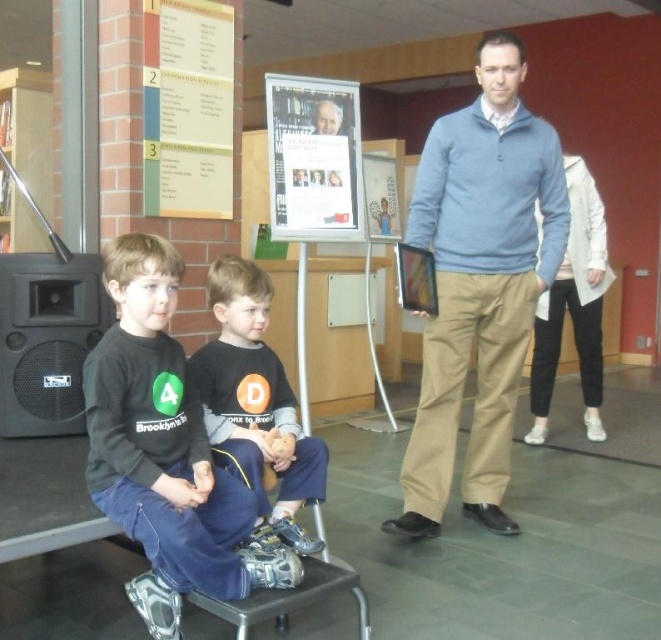
Question: Among these objects, which one is nearest to the camera?

Choices:
 (A) black cotton shirt at lower left
 (B) black matte speaker at left
 (C) smooth skin face at upper center
 (D) black cotton shirt at center

Answer: (A)

Question: Which point is farther to the camera?

Choices:
 (A) black cotton shirt at lower left
 (B) black matte speaker at left

Answer: (B)

Question: From the image, what is the correct spatial relationship of blue sweater at center in relation to black matte speaker at left?

Choices:
 (A) above
 (B) below

Answer: (A)

Question: Which point is closer to the camera?

Choices:
 (A) (81, 256)
 (B) (182, 118)
 (C) (297, 531)

Answer: (C)

Question: Is black cotton shirt at lower left above smooth skin face at upper center?

Choices:
 (A) no
 (B) yes

Answer: (A)

Question: Does black cotton shirt at center have a greater width compared to black matte speaker at left?

Choices:
 (A) no
 (B) yes

Answer: (B)